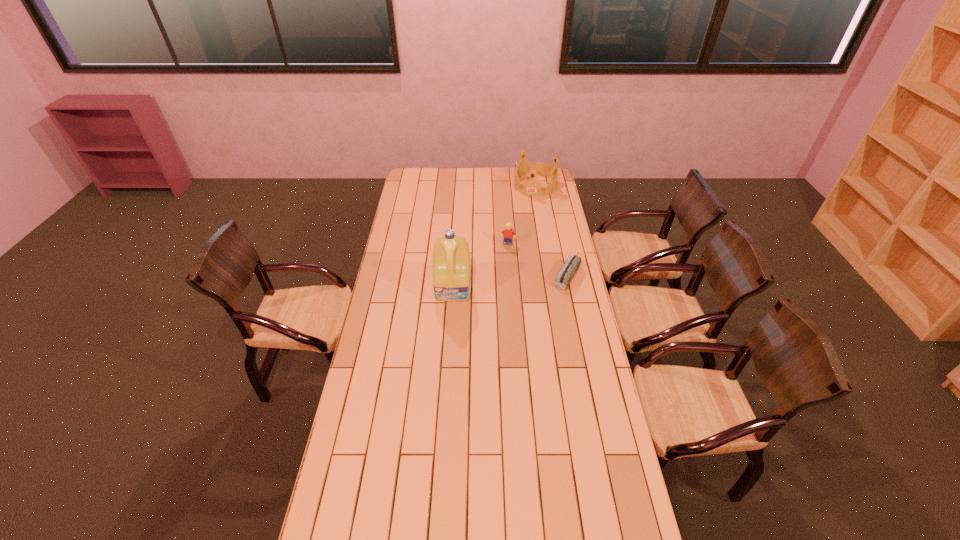
Locate an element on the screen. This screenshot has height=540, width=960. the leftmost object is located at coordinates (451, 259).

The width and height of the screenshot is (960, 540). I want to click on detergent, so click(451, 259).

Locate an element on the screen. The image size is (960, 540). pencil box is located at coordinates (568, 270).

Identify the location of tiara. (532, 187).

At what (x,y) coordinates should I click in order to perform the action: click on the third shortest object. Please return your answer as a coordinate pair (x, y). Looking at the image, I should click on (532, 187).

This screenshot has width=960, height=540. Identify the location of Lego. click(x=509, y=233).

Where is `the third nearest object`? The image size is (960, 540). the third nearest object is located at coordinates (509, 233).

You are a GUI agent. You are given a task and a screenshot of the screen. Output one action in this format:
    pyautogui.click(x=<x>, y=<y>)
    Task: Click on the free location located 0.180m on the label of the tallest object
    
    Given the screenshot: What is the action you would take?
    pyautogui.click(x=451, y=334)

The width and height of the screenshot is (960, 540). What are the coordinates of `vacant position located on the front of the pencil box` in the screenshot? It's located at (572, 301).

Image resolution: width=960 pixels, height=540 pixels. I want to click on blank area located on the front-facing side of the tiara, so click(x=521, y=225).